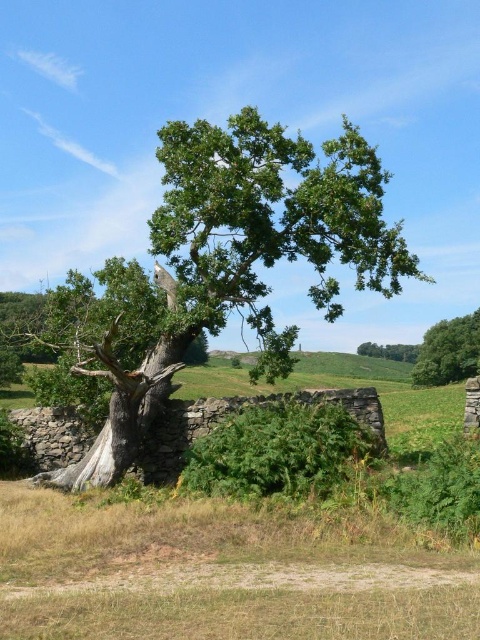
Question: Does green leafy oak tree at center have a smaller size compared to green leafy tree at upper right?

Choices:
 (A) no
 (B) yes

Answer: (A)

Question: Is green leafy oak tree at center in front of green leafy tree at upper right?

Choices:
 (A) no
 (B) yes

Answer: (B)

Question: In this image, where is green leafy oak tree at center located relative to green leafy tree at upper right?

Choices:
 (A) above
 (B) below

Answer: (A)